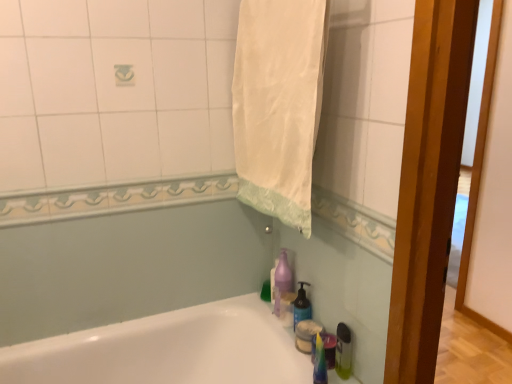
What are the coordinates of `vacant space underneath white fabric towel at upper center (from a real-world perspective)` in the screenshot? It's located at (276, 327).